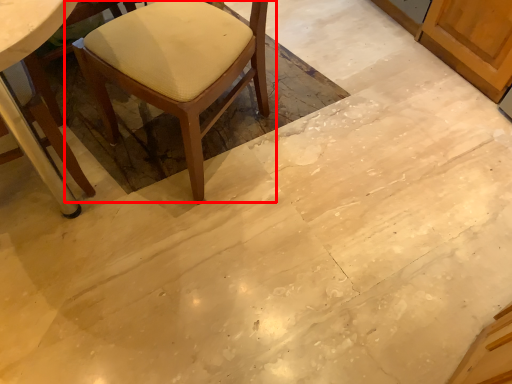
Question: In this image, where is chair (annotated by the red box) located relative to chair?

Choices:
 (A) left
 (B) right

Answer: (B)